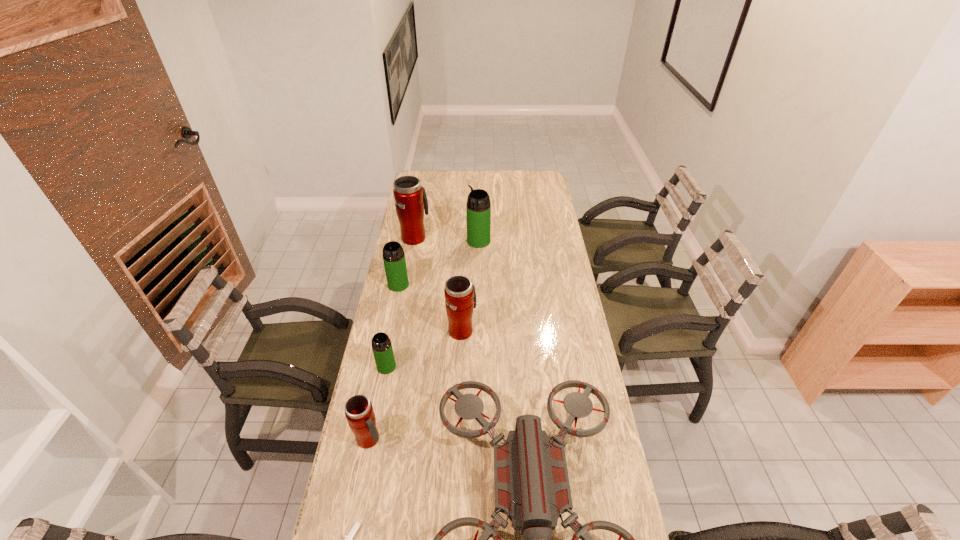
This screenshot has width=960, height=540. I want to click on the nearest red thermos bottle, so click(x=359, y=412).

I want to click on vacant region located from the spout of the biggest green thermos bottle, so click(x=449, y=241).

You are a GUI agent. You are given a task and a screenshot of the screen. Output one action in this format:
    pyautogui.click(x=<x>, y=<y>)
    Task: Click on the vacant area located from the spout of the biggest green thermos bottle
    Image resolution: width=960 pixels, height=540 pixels.
    Given the screenshot: What is the action you would take?
    pyautogui.click(x=439, y=241)

Where is `vacant space located from the spout of the biggest green thermos bottle`? vacant space located from the spout of the biggest green thermos bottle is located at coordinates (411, 241).

Locate an element on the screen. free space located on the side with the handle of the biggest red thermos bottle is located at coordinates (419, 219).

This screenshot has height=540, width=960. In order to click on free region located on the side with the handle of the biggest red thermos bottle in this screenshot , I will do `click(420, 207)`.

At what (x,y) coordinates should I click in order to perform the action: click on free region located 0.300m on the side with the handle of the biggest red thermos bottle. Please return your answer as a coordinate pair (x, y). The width and height of the screenshot is (960, 540). Looking at the image, I should click on (422, 195).

The image size is (960, 540). I want to click on vacant region located 0.200m from the spout of the third farthest object, so click(390, 329).

Identify the location of vacant space located 0.280m on the side with the handle of the fifth nearest object. This screenshot has height=540, width=960. (465, 271).

This screenshot has width=960, height=540. I want to click on vacant space located on the side with the handle of the fifth nearest object, so click(464, 275).